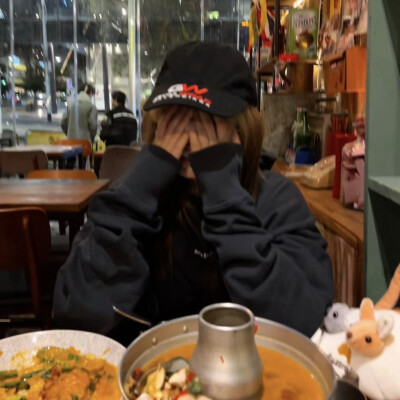
Find the location of a particular element. The image size is (400, 400). wooden chair is located at coordinates (18, 156).